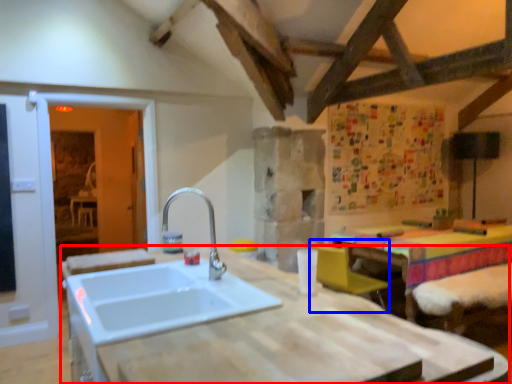
Question: Which point is closer to the camera, countertop (highlighted by a red box) or armchair (highlighted by a blue box)?

Choices:
 (A) countertop
 (B) armchair

Answer: (A)